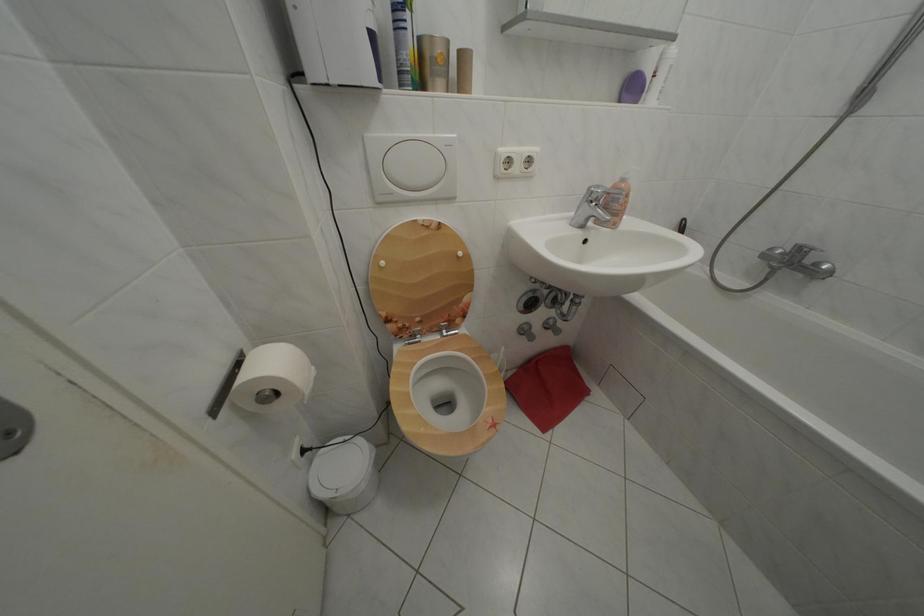
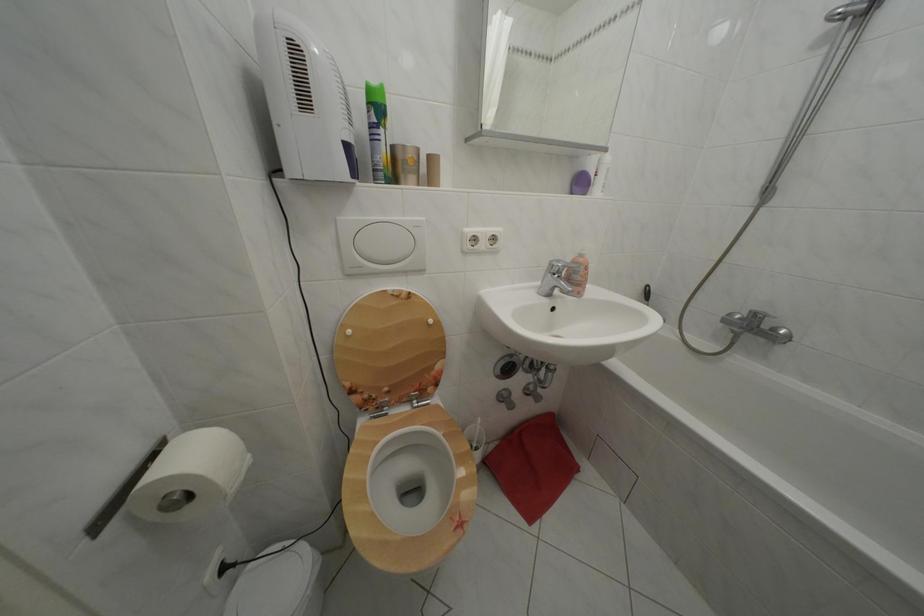
The point at (824, 270) is marked in the first image. Where is the corresponding point in the second image?

(783, 336)